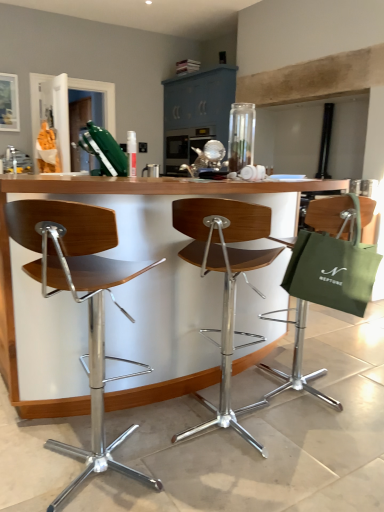
Find the location of a particular element. The height and width of the screenshot is (512, 384). free space in front of wooden seat at center, which is counted as the second chair, starting from the left is located at coordinates (241, 487).